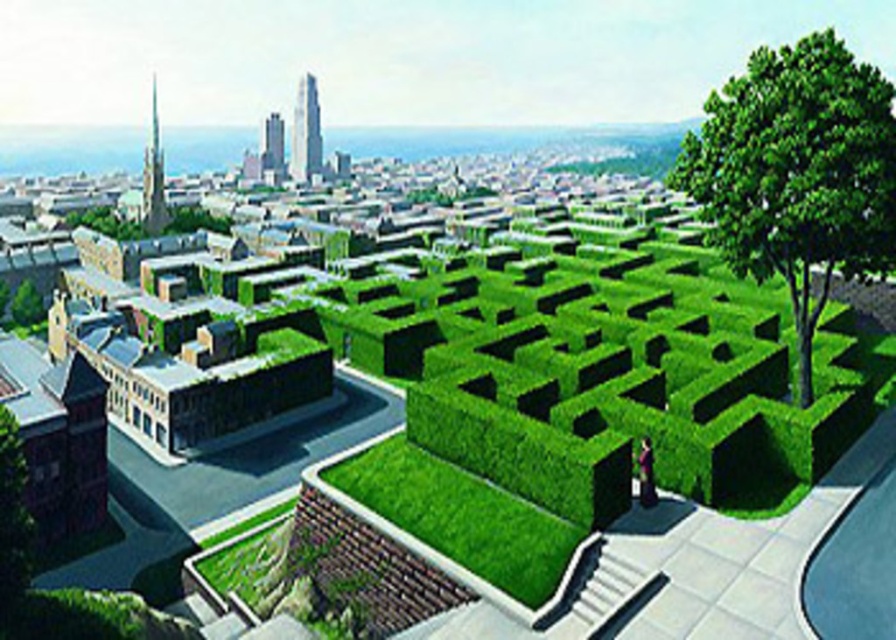
Which is in front, point (820, 80) or point (513, 552)?

Point (513, 552) is more forward.

Is green leafy tree at upper right behind green hedge at center?

Yes, green leafy tree at upper right is further from the viewer.

Is point (854, 253) in front of point (441, 528)?

No, (854, 253) is further to viewer.

Image resolution: width=896 pixels, height=640 pixels. In order to click on green leafy tree at upper right in this screenshot , I will do `click(797, 173)`.